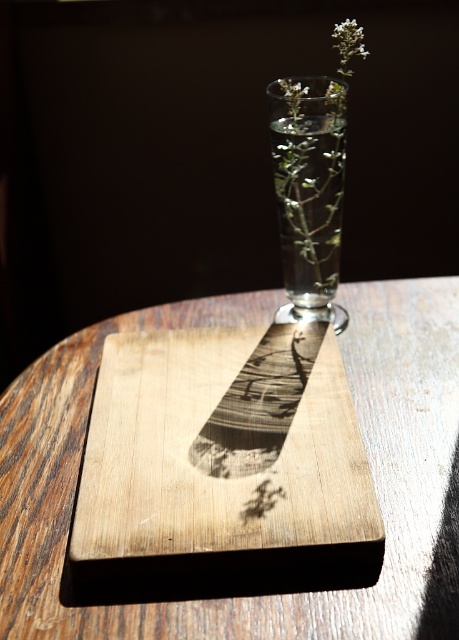
Locate an element on the screen. natural wood cutting board at center is located at coordinates (207, 468).

Is point (190, 508) closer to viewer compared to point (295, 125)?

Yes, point (190, 508) is closer to viewer.

Who is more distant from viewer, (329,454) or (294,120)?

The point (294,120) is more distant.

The height and width of the screenshot is (640, 459). Find the location of `natural wood cutting board at center`. natural wood cutting board at center is located at coordinates (207, 468).

Consider the image. Is wooden board at center taller than white matte flower at upper center?

Yes, wooden board at center is taller than white matte flower at upper center.

Measure the distance between wooden board at center and camera.

A distance of 11.82 inches exists between wooden board at center and camera.

Between point (3, 403) and point (350, 29), which one is positioned behind?

Point (3, 403)

In order to click on wooden board at center in this screenshot , I will do `click(247, 570)`.

Can you confirm if wooden board at center is positioned to the right of natural wood cutting board at center?

Indeed, wooden board at center is positioned on the right side of natural wood cutting board at center.

Can you confirm if wooden board at center is wider than natural wood cutting board at center?

Yes, wooden board at center is wider than natural wood cutting board at center.

Between point (385, 477) and point (279, 550), which one is positioned behind?

Positioned behind is point (385, 477).

You are a GUI agent. You are given a task and a screenshot of the screen. Output one action in this format:
    pyautogui.click(x=<x>, y=<y>)
    Task: Click on the wooden board at center
    The width and height of the screenshot is (459, 640).
    Given the screenshot: What is the action you would take?
    pyautogui.click(x=247, y=570)